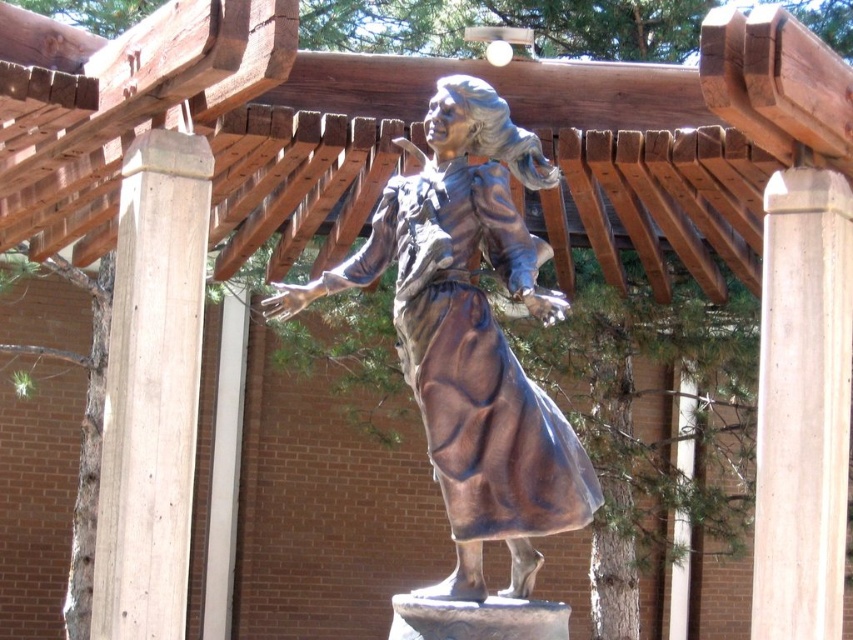
You are standing in front of the bronze statue under the wooden pergola. There are two points marked on the statue. Which point, point (454, 243) or point (189, 413), is closer to you?

Point (454, 243) is closer to the viewer than point (189, 413).

You are a maintenance worker needing to place a 3.14 meter long safety barrier between the bronze statue at center and the smooth concrete pillar at right. Can the barrier fit exactly between them without exceeding the space?

The distance between the bronze statue at center and the smooth concrete pillar at right is exactly 3.14 meters, so the barrier can fit perfectly without exceeding the space.